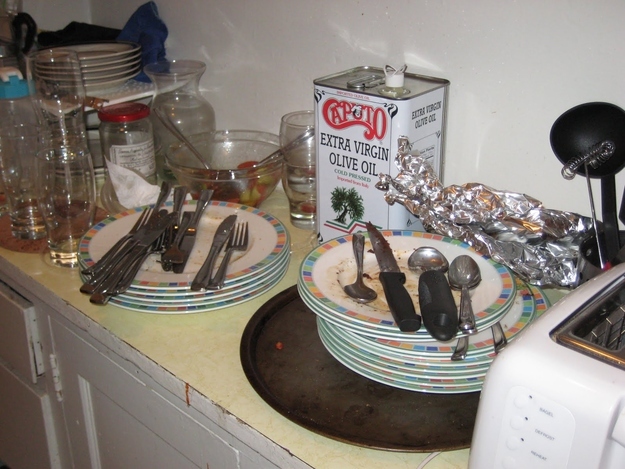
The image size is (625, 469). What are the coordinates of `dishes` in the screenshot? It's located at (418, 239).